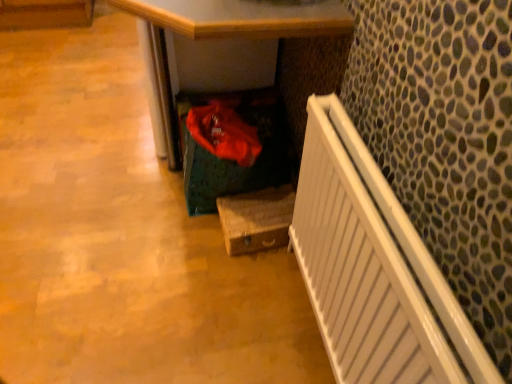
Question: Does wooden box at lower center have a lesser width compared to white glossy radiator at right?

Choices:
 (A) no
 (B) yes

Answer: (A)

Question: Does wooden box at lower center contain white glossy radiator at right?

Choices:
 (A) yes
 (B) no

Answer: (B)

Question: Is the position of wooden box at lower center more distant than that of white glossy radiator at right?

Choices:
 (A) yes
 (B) no

Answer: (A)

Question: Does wooden box at lower center turn towards white glossy radiator at right?

Choices:
 (A) no
 (B) yes

Answer: (A)

Question: From the image's perspective, is wooden box at lower center over white glossy radiator at right?

Choices:
 (A) no
 (B) yes

Answer: (B)

Question: In the image, is wooden at lower center on the left side or the right side of wooden box at lower center?

Choices:
 (A) right
 (B) left

Answer: (B)

Question: Is wooden at lower center bigger or smaller than wooden box at lower center?

Choices:
 (A) big
 (B) small

Answer: (A)

Question: From a real-world perspective, relative to wooden box at lower center, is wooden at lower center vertically above or below?

Choices:
 (A) above
 (B) below

Answer: (A)

Question: Is wooden at lower center situated inside wooden box at lower center or outside?

Choices:
 (A) inside
 (B) outside

Answer: (B)

Question: Is wooden at lower center inside the boundaries of white glossy radiator at right, or outside?

Choices:
 (A) inside
 (B) outside

Answer: (B)

Question: From the image's perspective, relative to white glossy radiator at right, is wooden at lower center above or below?

Choices:
 (A) above
 (B) below

Answer: (A)

Question: Relative to white glossy radiator at right, is wooden at lower center in front or behind?

Choices:
 (A) behind
 (B) front

Answer: (A)

Question: From their relative heights in the image, would you say wooden at lower center is taller or shorter than white glossy radiator at right?

Choices:
 (A) short
 (B) tall

Answer: (B)

Question: In terms of height, does wooden box at lower center look taller or shorter compared to white glossy radiator at right?

Choices:
 (A) short
 (B) tall

Answer: (A)

Question: Is wooden box at lower center to the left or to the right of white glossy radiator at right in the image?

Choices:
 (A) left
 (B) right

Answer: (A)